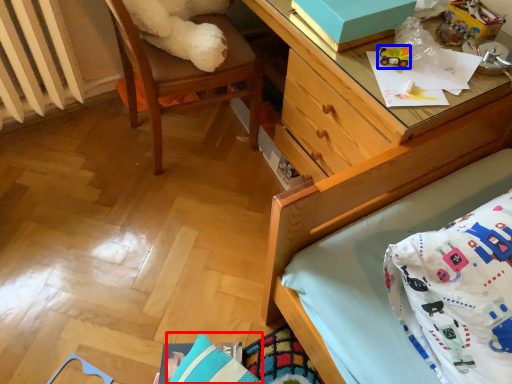
Question: Among these objects, which one is nearest to the camera, pillow (highlighted by a red box) or toy (highlighted by a blue box)?

Choices:
 (A) pillow
 (B) toy

Answer: (A)